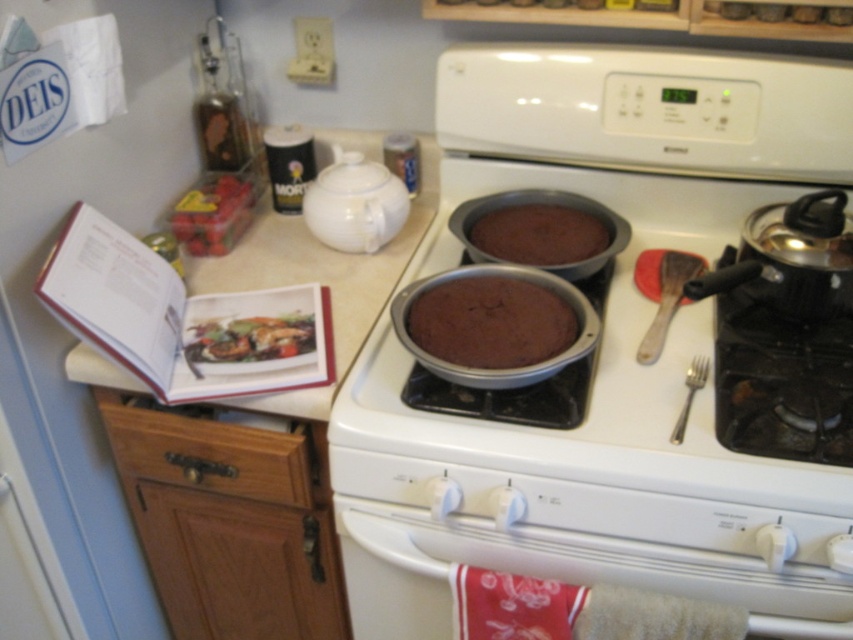
Between point (119, 435) and point (503, 250), which one is positioned in front?

Point (119, 435)

Between wooden drawer at lower left and dark brown cake at center, which one is positioned lower?

wooden drawer at lower left

You are a GUI agent. You are given a task and a screenshot of the screen. Output one action in this format:
    pyautogui.click(x=<x>, y=<y>)
    Task: Click on the wooden drawer at lower left
    The image size is (853, 640).
    Given the screenshot: What is the action you would take?
    pyautogui.click(x=207, y=452)

Does chocolate matte pan at center appear under shiny red berries at left?

Indeed, chocolate matte pan at center is positioned under shiny red berries at left.

Does chocolate matte pan at center come in front of shiny red berries at left?

Yes.

Between point (547, 310) and point (210, 195), which one is positioned in front?

Point (547, 310) is in front.

In order to click on chocolate matte pan at center in this screenshot , I will do tap(490, 321).

Who is more distant from viewer, (312, 340) or (189, 189)?

Point (189, 189)

What are the coordinates of `shiny brown meat at center` in the screenshot? It's located at (251, 339).